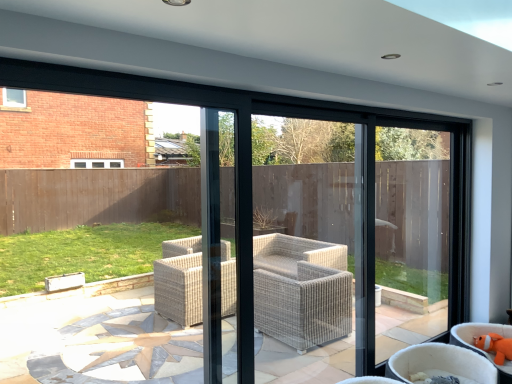
Question: From the image's perspective, relative to orange plush toy at lower right, is orange plush toy at lower right, which is the 2th chair from left to right, above or below?

Choices:
 (A) above
 (B) below

Answer: (B)

Question: Looking at the image, does orange plush toy at lower right, positioned as the 1th chair in right-to-left order, seem bigger or smaller compared to orange plush toy at lower right?

Choices:
 (A) small
 (B) big

Answer: (B)

Question: Which object is positioned farthest from the beige wicker chair at lower right, which is counted as the 1th chair, starting from the left?

Choices:
 (A) orange plush toy at lower right
 (B) orange plush toy at lower right, which is the 2th chair from left to right

Answer: (A)

Question: Which of these objects is positioned farthest from the orange plush toy at lower right?

Choices:
 (A) orange plush toy at lower right, which is the 2th chair from left to right
 (B) beige wicker chair at lower right, which is counted as the 1th chair, starting from the left

Answer: (B)